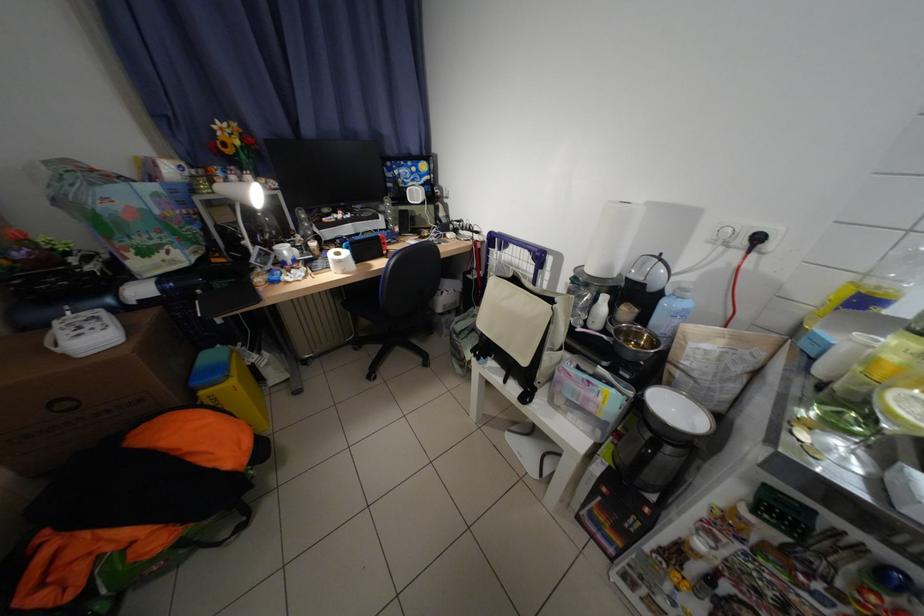
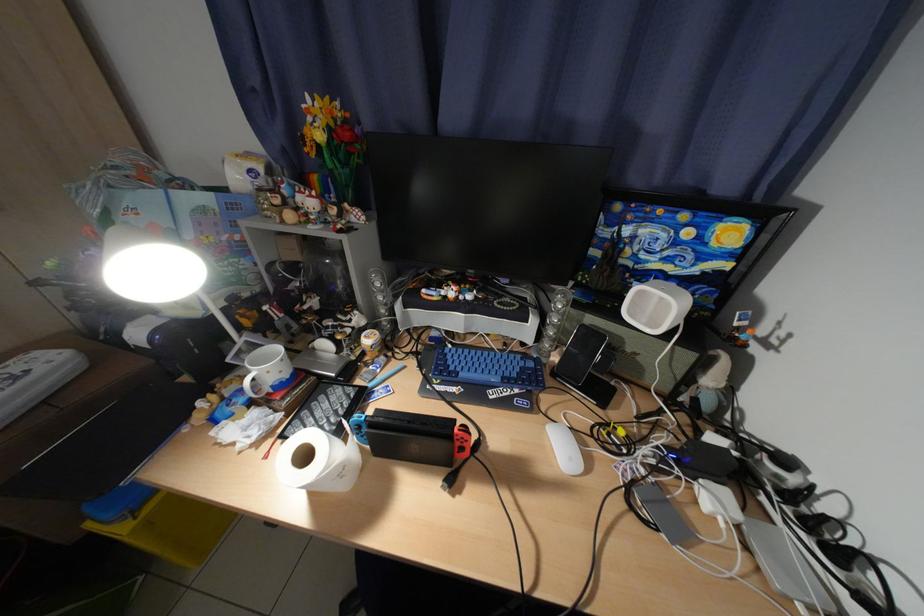
Find the pixel in the second image that matches (x=249, y=143) in the first image.

(331, 138)